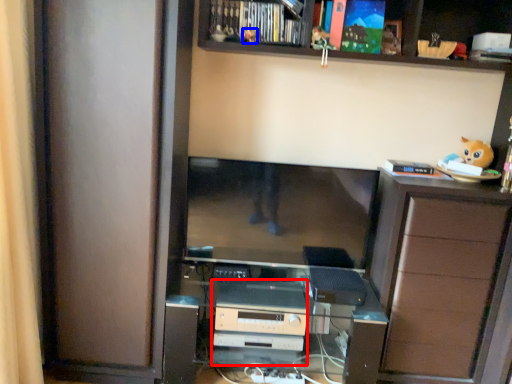
Question: Among these objects, which one is farthest to the camera, appliance (highlighted by a red box) or toy (highlighted by a blue box)?

Choices:
 (A) appliance
 (B) toy

Answer: (A)